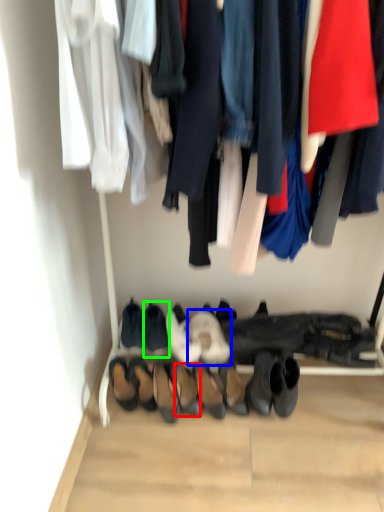
Question: Considering the real-world distances, which object is closest to footwear (highlighted by a red box)? footwear (highlighted by a blue box) or footwear (highlighted by a green box).

Choices:
 (A) footwear
 (B) footwear

Answer: (A)